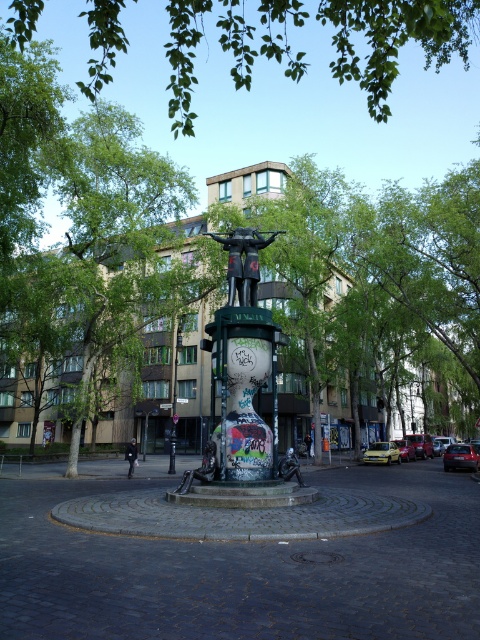
Question: Which object appears farthest from the camera in this image?

Choices:
 (A) yellow matte car at center
 (B) yellow matte car at lower right
 (C) graffiti-covered metal sculpture at center

Answer: (A)

Question: Is graffiti-covered metal sculpture at center to the left of black matte sculpture at center from the viewer's perspective?

Choices:
 (A) no
 (B) yes

Answer: (B)

Question: Considering the real-world distances, which object is farthest from the shiny red sedan at center?

Choices:
 (A) black matte sculpture at center
 (B) matte yellow car at center
 (C) graffiti-covered metal sculpture at center

Answer: (A)

Question: Estimate the real-world distances between objects in this image. Which object is closer to the black matte sculpture at center?

Choices:
 (A) yellow matte car at center
 (B) shiny red sedan at center
 (C) matte yellow car at center

Answer: (B)

Question: Where is yellow matte car at lower right located in relation to yellow matte car at center in the image?

Choices:
 (A) below
 (B) above

Answer: (A)

Question: Does green leafy branches at upper center appear on the left side of graffiti-covered metal sculpture at center?

Choices:
 (A) yes
 (B) no

Answer: (B)